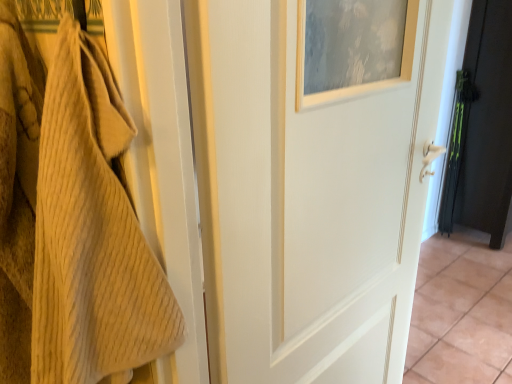
You are a GUI agent. You are given a task and a screenshot of the screen. Output one action in this format:
    pyautogui.click(x=<x>, y=<y>)
    Task: Click on the white glossy tile at center
    This screenshot has width=512, height=384.
    Given the screenshot: What is the action you would take?
    pyautogui.click(x=461, y=312)

Describe the element at coordinates (486, 128) in the screenshot. I see `black matte door at right, arranged as the first door when viewed from the right` at that location.

Locate an element on the screen. The height and width of the screenshot is (384, 512). beige textured towel at left is located at coordinates (71, 222).

What do you see at coordinates (312, 200) in the screenshot? I see `white painted wood door at center, the 2th door in the right-to-left sequence` at bounding box center [312, 200].

At what (x,y) coordinates should I click in order to perform the action: click on white glossy tile at center. Please return your answer as a coordinate pair (x, y). Looking at the image, I should click on (461, 312).

Which is less distant, (x=477, y=267) or (x=463, y=193)?

The point (x=477, y=267) is more forward.

Between white glossy tile at center and black matte door at right, which appears as the second door when viewed from the front, which one appears on the right side from the viewer's perspective?

black matte door at right, which appears as the second door when viewed from the front.

Is white glossy tile at center facing towards black matte door at right, the first door when ordered from back to front?

No, white glossy tile at center is not aimed at black matte door at right, the first door when ordered from back to front.

Would you say beige textured towel at left is inside or outside black matte door at right, arranged as the first door when viewed from the right?

beige textured towel at left is outside black matte door at right, arranged as the first door when viewed from the right.

Between beige textured towel at left and black matte door at right, the first door when ordered from back to front, which one appears on the right side from the viewer's perspective?

black matte door at right, the first door when ordered from back to front, is more to the right.

Does beige textured towel at left lie in front of black matte door at right, arranged as the first door when viewed from the right?

Yes, it is in front of black matte door at right, arranged as the first door when viewed from the right.

Consider the image. Is beige textured towel at left thinner than black matte door at right, which is counted as the 2th door, starting from the left?

Correct, the width of beige textured towel at left is less than that of black matte door at right, which is counted as the 2th door, starting from the left.

Does point (492, 45) appear closer or farther from the camera than point (353, 363)?

Point (492, 45).

Which object is positioned more to the right, black matte door at right, arranged as the first door when viewed from the right, or white painted wood door at center, the 2th door in the right-to-left sequence?

black matte door at right, arranged as the first door when viewed from the right.

How different are the orientations of black matte door at right, which appears as the second door when viewed from the front, and white painted wood door at center, the 2th door in the right-to-left sequence, in degrees?

They differ by 6.32e-05 degrees in their facing directions.

From a real-world perspective, which is physically above, white painted wood door at center, the 1th door from the front, or black matte door at right, arranged as the first door when viewed from the right?

From a 3D spatial view, white painted wood door at center, the 1th door from the front, is above.

From the image's perspective, which one is positioned lower, white painted wood door at center, the second door positioned from the back, or black matte door at right, arranged as the first door when viewed from the right?

From the image's view, white painted wood door at center, the second door positioned from the back, is below.

I want to click on door above the white painted wood door at center, the 2th door in the right-to-left sequence (from the image's perspective), so click(486, 128).

Considering the relative sizes of white painted wood door at center, the 1th door from the front, and black matte door at right, the first door when ordered from back to front, in the image provided, is white painted wood door at center, the 1th door from the front, bigger than black matte door at right, the first door when ordered from back to front,?

No, white painted wood door at center, the 1th door from the front, is not bigger than black matte door at right, the first door when ordered from back to front.

From the image's perspective, relative to white glossy tile at center, is white painted wood door at center, the 2th door in the right-to-left sequence, above or below?

white painted wood door at center, the 2th door in the right-to-left sequence, is situated higher than white glossy tile at center in the image.

In terms of height, does white painted wood door at center, the 2th door in the right-to-left sequence, look taller or shorter compared to white glossy tile at center?

In the image, white painted wood door at center, the 2th door in the right-to-left sequence, appears to be taller than white glossy tile at center.

Is point (225, 305) farther from camera compared to point (445, 376)?

No, it is in front of (445, 376).

Is white glossy tile at center far from white painted wood door at center, the second door positioned from the back?

white glossy tile at center is positioned a significant distance from white painted wood door at center, the second door positioned from the back.

Which point is more distant from viewer, (454,361) or (320,228)?

Point (454,361)

Is white glossy tile at center aimed at white painted wood door at center, the second door positioned from the back?

No, white glossy tile at center is not facing towards white painted wood door at center, the second door positioned from the back.

From a real-world perspective, is white glossy tile at center physically below white painted wood door at center, the 1th door from the front?

Indeed, from a real-world perspective, white glossy tile at center is positioned beneath white painted wood door at center, the 1th door from the front.

What are the coordinates of `door that is the 2nd object to the right of the beige textured towel at left, starting at the anchor` in the screenshot? It's located at (486, 128).

Measure the distance between black matte door at right, which is counted as the 2th door, starting from the left, and beige textured towel at left.

black matte door at right, which is counted as the 2th door, starting from the left, is 2.88 meters away from beige textured towel at left.

From the image's perspective, does black matte door at right, which appears as the second door when viewed from the front, appear higher than beige textured towel at left?

Yes, from the image's perspective, black matte door at right, which appears as the second door when viewed from the front, is on top of beige textured towel at left.

Based on the photo, from a real-world perspective, is black matte door at right, arranged as the first door when viewed from the right, below beige textured towel at left?

Indeed, from a real-world perspective, black matte door at right, arranged as the first door when viewed from the right, is positioned beneath beige textured towel at left.

Locate an element on the screen. The width and height of the screenshot is (512, 384). door that is behind the white glossy tile at center is located at coordinates (486, 128).

Find the location of a particular element. This screenshot has width=512, height=384. towel below the black matte door at right, arranged as the first door when viewed from the right (from the image's perspective) is located at coordinates (71, 222).

Considering their positions, is black matte door at right, which is counted as the 2th door, starting from the left, positioned further to beige textured towel at left than white glossy tile at center?

black matte door at right, which is counted as the 2th door, starting from the left, is positioned further to the anchor beige textured towel at left.

Estimate the real-world distances between objects in this image. Which object is further from black matte door at right, arranged as the first door when viewed from the right, beige textured towel at left or white glossy tile at center?

beige textured towel at left is positioned further to the anchor black matte door at right, arranged as the first door when viewed from the right.

Which object lies nearer to the anchor point white glossy tile at center, white painted wood door at center, the 2th door in the right-to-left sequence, or beige textured towel at left?

Based on the image, white painted wood door at center, the 2th door in the right-to-left sequence, appears to be nearer to white glossy tile at center.

Based on their spatial positions, is beige textured towel at left or black matte door at right, which is counted as the 2th door, starting from the left, further from white painted wood door at center, the 2th door in the right-to-left sequence?

black matte door at right, which is counted as the 2th door, starting from the left, lies further to white painted wood door at center, the 2th door in the right-to-left sequence, than the other object.

When comparing their distances from black matte door at right, the first door when ordered from back to front, does white painted wood door at center, which ranks as the 1th door in left-to-right order, or white glossy tile at center seem closer?

Among the two, white glossy tile at center is located nearer to black matte door at right, the first door when ordered from back to front.

When comparing their distances from beige textured towel at left, does white glossy tile at center or white painted wood door at center, which ranks as the 1th door in left-to-right order, seem closer?

Among the two, white painted wood door at center, which ranks as the 1th door in left-to-right order, is located nearer to beige textured towel at left.

Which object lies further to the anchor point black matte door at right, arranged as the first door when viewed from the right, beige textured towel at left or white painted wood door at center, the 2th door in the right-to-left sequence?

Among the two, beige textured towel at left is located further to black matte door at right, arranged as the first door when viewed from the right.

Based on their spatial positions, is white glossy tile at center or white painted wood door at center, the 2th door in the right-to-left sequence, closer to black matte door at right, the first door when ordered from back to front?

Among the two, white glossy tile at center is located nearer to black matte door at right, the first door when ordered from back to front.

Locate an element on the screen. door situated between beige textured towel at left and black matte door at right, which is counted as the 2th door, starting from the left, from left to right is located at coordinates (312, 200).

The image size is (512, 384). I want to click on tile between beige textured towel at left and black matte door at right, the first door when ordered from back to front, in the horizontal direction, so click(461, 312).

At what (x,y) coordinates should I click in order to perform the action: click on tile between white painted wood door at center, the second door positioned from the back, and black matte door at right, the first door when ordered from back to front, from front to back. Please return your answer as a coordinate pair (x, y). Looking at the image, I should click on (461, 312).

You are a GUI agent. You are given a task and a screenshot of the screen. Output one action in this format:
    pyautogui.click(x=<x>, y=<y>)
    Task: Click on the door between beige textured towel at left and white glossy tile at center
    The width and height of the screenshot is (512, 384).
    Given the screenshot: What is the action you would take?
    pyautogui.click(x=312, y=200)